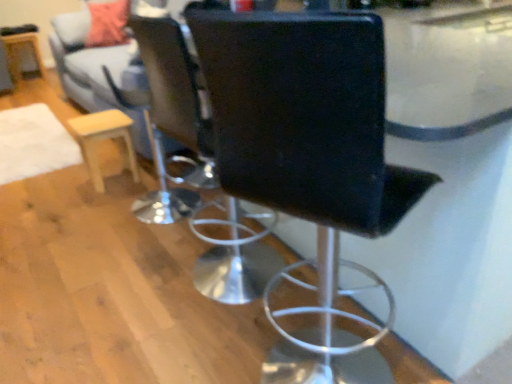
I want to click on free region on the left part of black leather chair at center, the 2th chair when ordered from back to front, so click(x=181, y=346).